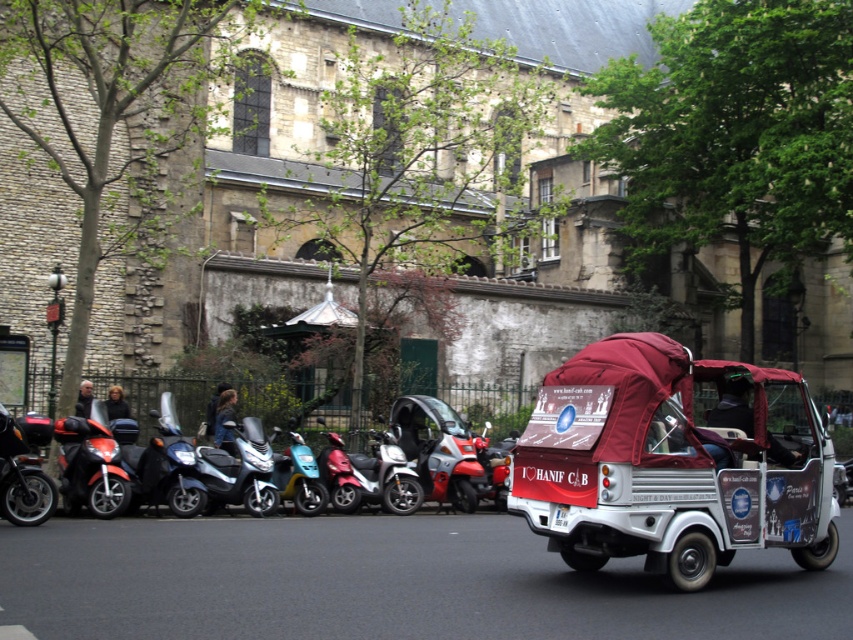
Find the location of a particular element. This screenshot has width=853, height=640. metallic silver tricycle at center right is located at coordinates (671, 464).

Who is more distant from viewer, (822, 496) or (354, 470)?

Positioned behind is point (354, 470).

Where is `metallic silver tricycle at center right`? This screenshot has height=640, width=853. metallic silver tricycle at center right is located at coordinates (671, 464).

Can you confirm if metallic silver tricycle at center right is positioned to the left of metallic blue scooter at center?

In fact, metallic silver tricycle at center right is to the right of metallic blue scooter at center.

You are a GUI agent. You are given a task and a screenshot of the screen. Output one action in this format:
    pyautogui.click(x=<x>, y=<y>)
    Task: Click on the metallic silver tricycle at center right
    The width and height of the screenshot is (853, 640).
    Given the screenshot: What is the action you would take?
    671,464

This screenshot has height=640, width=853. I want to click on metallic silver tricycle at center right, so click(671, 464).

At what (x,y) coordinates should I click in order to perform the action: click on metallic silver tricycle at center right. Please return your answer as a coordinate pair (x, y). Image resolution: width=853 pixels, height=640 pixels. Looking at the image, I should click on (671, 464).

Identify the location of metallic silver tricycle at center right. The image size is (853, 640). (671, 464).